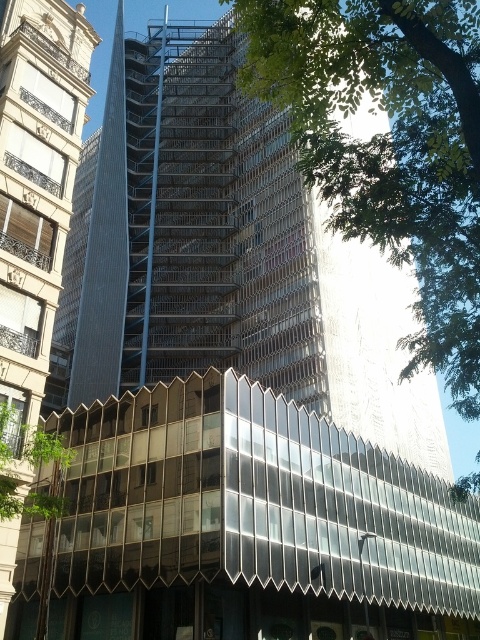
Who is more distant from viewer, (474, 314) or (51, 86)?

Point (51, 86)

Is point (301, 112) positioned in front of point (26, 22)?

Yes, point (301, 112) is closer to viewer.

Describe the element at coordinates (389, 147) in the screenshot. I see `green leafy tree at upper right` at that location.

Identify the location of green leafy tree at upper right. This screenshot has width=480, height=640. (389, 147).